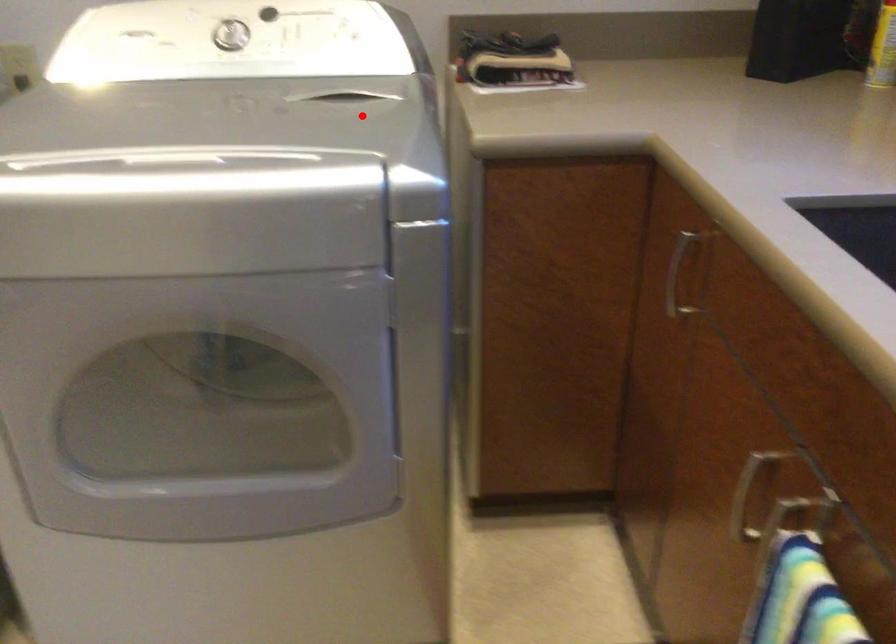
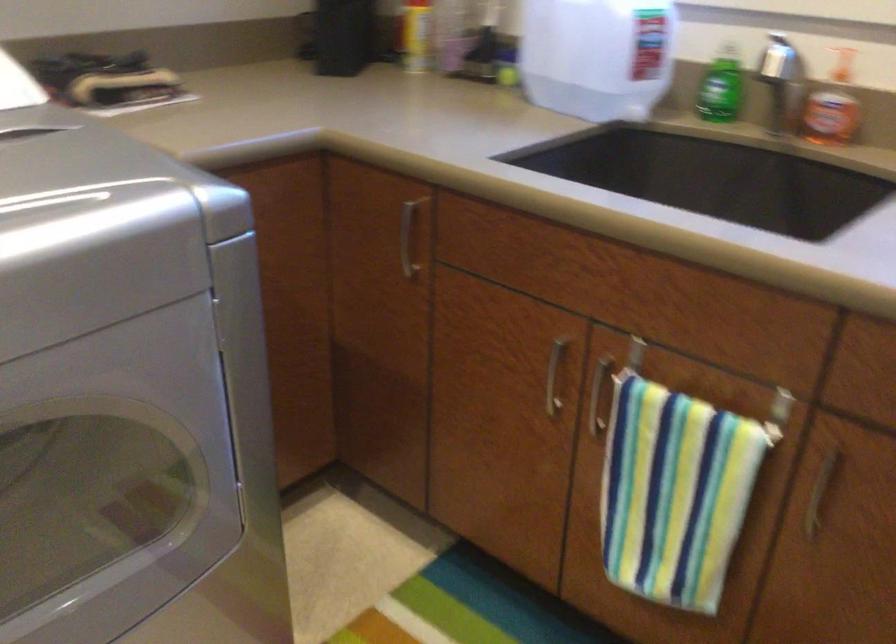
Locate, in the second image, the point that corresponds to the highlighted location in the first image.

(73, 155)